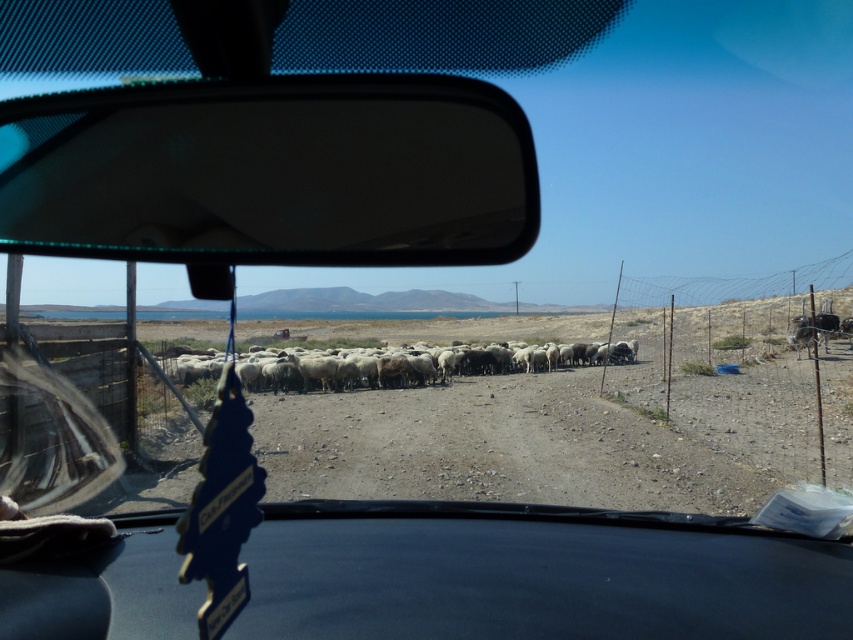
Question: Which of the following is the farthest from the observer?

Choices:
 (A) transparent plastic view mirror at upper center
 (B) black leather dashboard at center
 (C) white woolly sheep at center

Answer: (C)

Question: Does transparent plastic view mirror at upper center have a larger size compared to white woolly sheep at center?

Choices:
 (A) yes
 (B) no

Answer: (B)

Question: Can you confirm if transparent plastic view mirror at upper center is positioned above black leather dashboard at center?

Choices:
 (A) yes
 (B) no

Answer: (A)

Question: Which is nearer to the white woolly sheep at center?

Choices:
 (A) transparent plastic view mirror at upper center
 (B) black leather dashboard at center

Answer: (B)

Question: Which point is farther from the camera taking this photo?

Choices:
 (A) (296, 579)
 (B) (630, 346)

Answer: (B)

Question: Is transparent plastic view mirror at upper center wider than black leather dashboard at center?

Choices:
 (A) yes
 (B) no

Answer: (B)